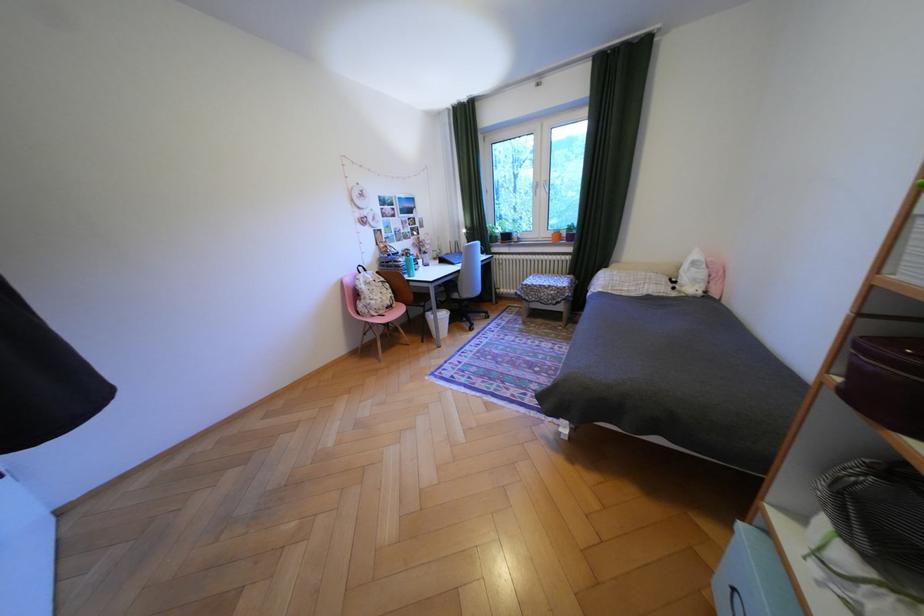
The location [715,278] corresponds to which object?

It refers to a pink pillow.